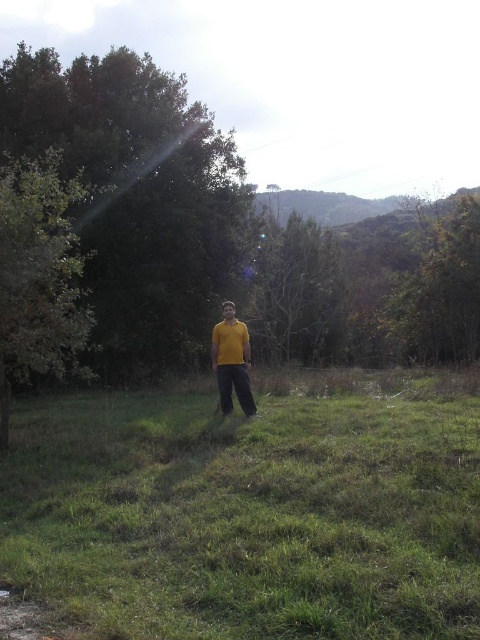
You are a photographer trying to capture a clear shot of the yellow matte shirt at center. However, the green grass at center is blocking part of the view. Can you estimate whether the grass is wider than the shirt to determine if you need to adjust your angle?

The green grass at center might be wider than yellow matte shirt at center, so adjusting the angle might be necessary to avoid obstruction.

You are standing in a grassy area surrounded by trees and shrubs and want to take a photo of the green leafy tree at center. Where should you position yourself to ensure the tree is in the center of your photo?

Answer: You should position yourself directly in front of the green leafy tree at center, as it is located at point [139,198], which would place it centrally in your photo frame.